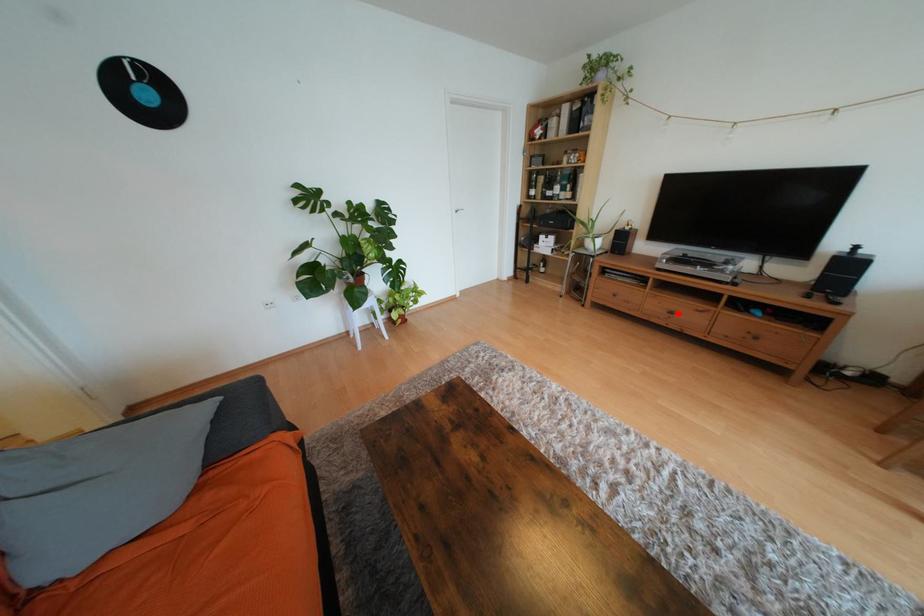
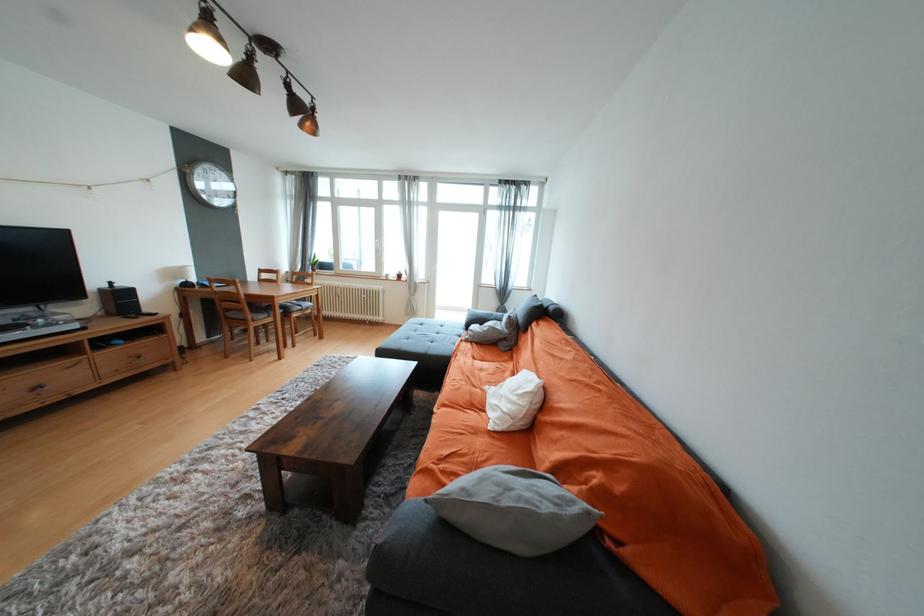
Question: I am providing you with two images of the same scene from different viewpoints. A red point is shown in image1. For the corresponding object point in image2, is it positioned nearer or farther from the camera?

Choices:
 (A) Nearer
 (B) Farther

Answer: (B)